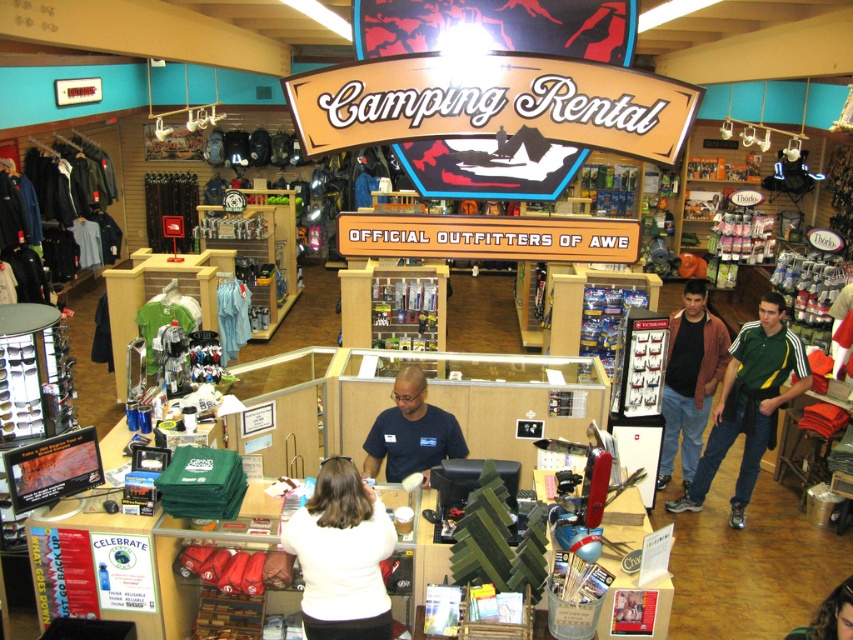
Question: Which object is farther from the camera taking this photo?

Choices:
 (A) blue shirt at center
 (B) green jersey at center

Answer: (B)

Question: Does white matte shirt at center have a smaller size compared to green jersey at center?

Choices:
 (A) yes
 (B) no

Answer: (A)

Question: Observing the image, what is the correct spatial positioning of white matte shirt at center in reference to brown leather jacket at lower right?

Choices:
 (A) below
 (B) above

Answer: (B)

Question: Which point is closer to the camera taking this photo?

Choices:
 (A) (422, 472)
 (B) (833, 598)
 (C) (351, 506)

Answer: (B)

Question: Considering the relative positions of green jersey at center and blue shirt at center in the image provided, where is green jersey at center located with respect to blue shirt at center?

Choices:
 (A) right
 (B) left

Answer: (A)

Question: Which of these objects is positioned farthest from the white matte shirt at center?

Choices:
 (A) brown leather jacket at lower right
 (B) brown leather jacket at right

Answer: (B)